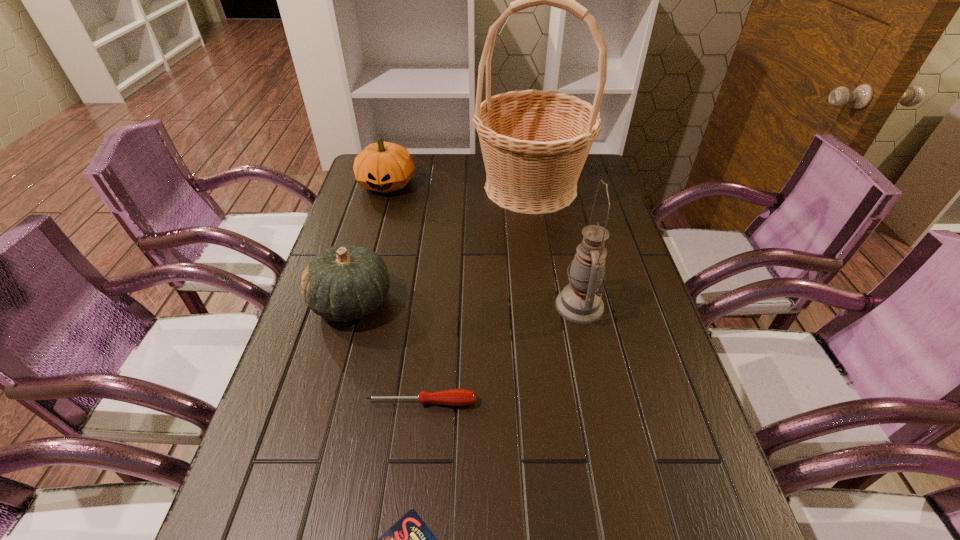
Locate an element on the screen. The width and height of the screenshot is (960, 540). free space at the far left corner of the desktop is located at coordinates (353, 189).

Locate an element on the screen. Image resolution: width=960 pixels, height=540 pixels. free space between the tallest object and the nearer gourd is located at coordinates (441, 245).

The width and height of the screenshot is (960, 540). Find the location of `vacant space that's between the basket and the farther gourd`. vacant space that's between the basket and the farther gourd is located at coordinates (459, 186).

At what (x,y) coordinates should I click in order to perform the action: click on free area in between the farther gourd and the basket. Please return your answer as a coordinate pair (x, y). The width and height of the screenshot is (960, 540). Looking at the image, I should click on (459, 186).

Image resolution: width=960 pixels, height=540 pixels. I want to click on vacant space that's between the second tallest object and the tallest object, so click(x=555, y=246).

The height and width of the screenshot is (540, 960). In order to click on vacant area that lies between the basket and the fifth tallest object in this screenshot , I will do `click(476, 295)`.

Locate an element on the screen. empty space that is in between the oil lamp and the basket is located at coordinates (555, 246).

The image size is (960, 540). Find the location of `vacant space that is in between the farther gourd and the nearer gourd`. vacant space that is in between the farther gourd and the nearer gourd is located at coordinates pos(370,243).

Where is `unoccupied area between the tallest object and the oil lamp`? The image size is (960, 540). unoccupied area between the tallest object and the oil lamp is located at coordinates (555, 246).

This screenshot has width=960, height=540. I want to click on vacant space that is in between the oil lamp and the nearer gourd, so click(466, 304).